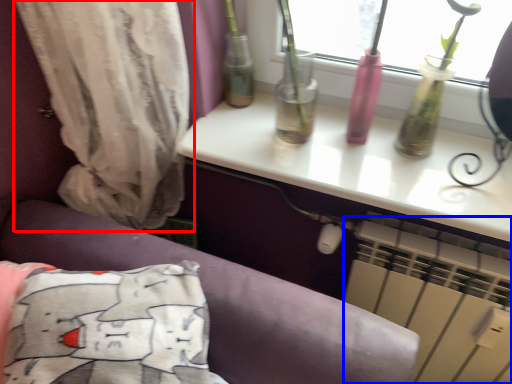
Question: Which object is closer to the camera taking this photo, curtain (highlighted by a red box) or air conditioning (highlighted by a blue box)?

Choices:
 (A) curtain
 (B) air conditioning

Answer: (A)